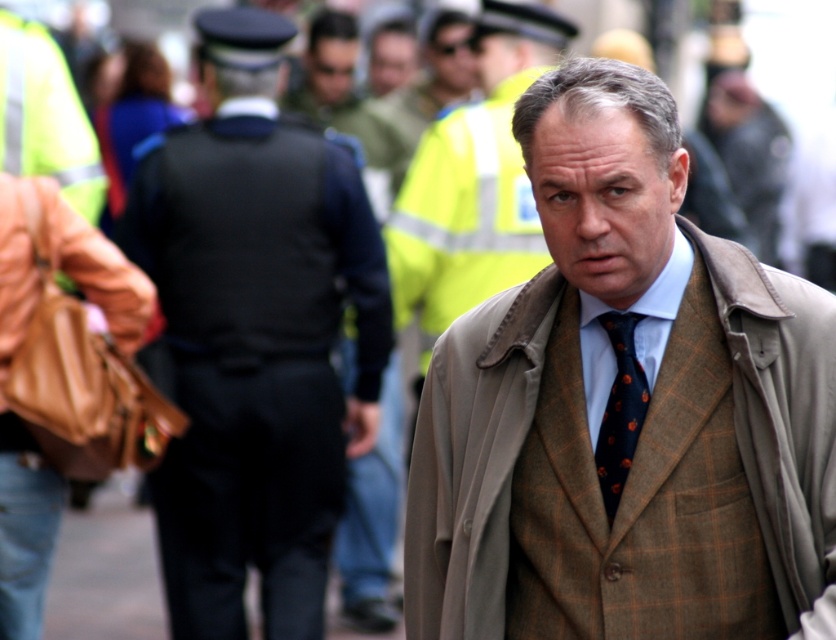
Based on the photo, you are a fashion designer analyzing the outfits in the image. You notice the dark blue uniform at center and the beige woolen trench coat at center. Which of these two items is taller?

The dark blue uniform at center is taller than the beige woolen trench coat at center.

You are a fashion designer analyzing the urban scene. You need to determine if the dark blue uniform at center can be worn with the dark blue textured tie at center. Based on their spatial relationship, is there any reason this combination would be problematic?

The dark blue uniform at center might be wider than dark blue textured tie at center, so the combination could be problematic as the wider uniform may overpower the narrower tie, creating an imbalance in the outfit.